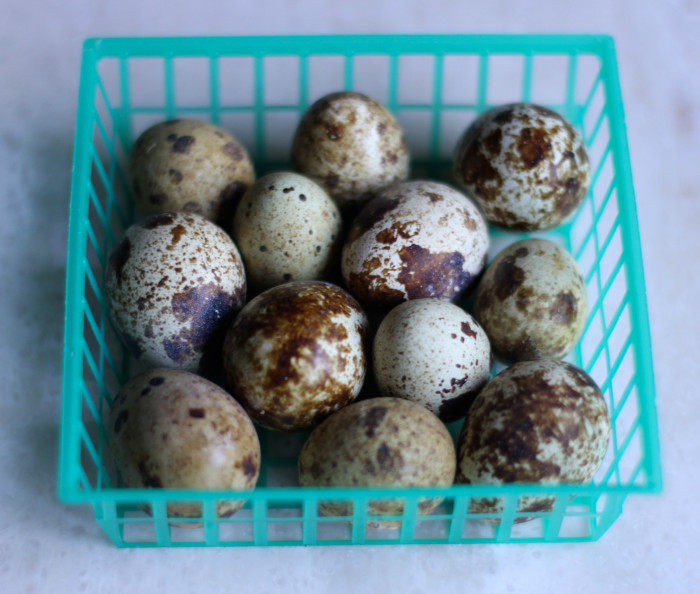
The height and width of the screenshot is (594, 700). Find the location of `crate`. crate is located at coordinates (609, 350).